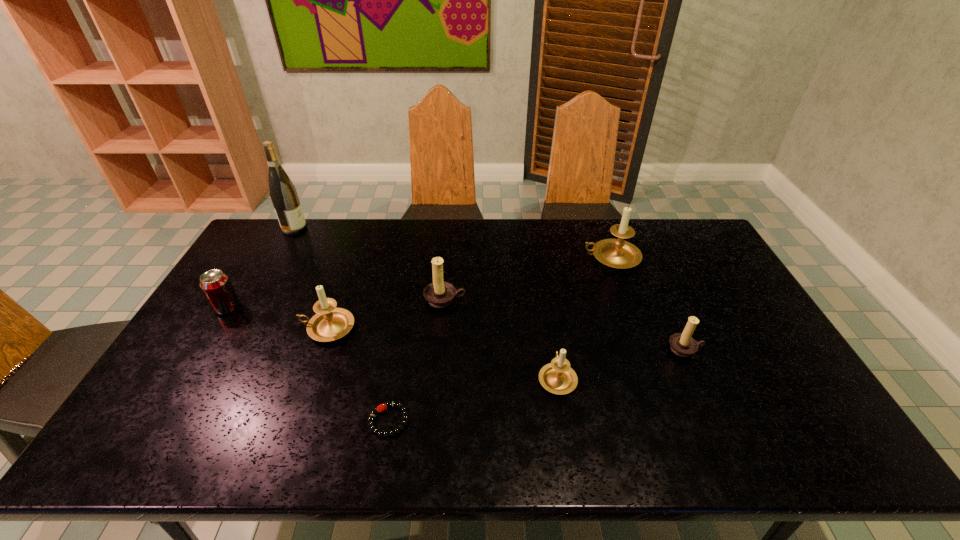
Select which object appears as the sixth closest to the nearest candle holder. Please provide its 2D coordinates. Your answer should be formatted as a tuple, i.e. [(x, y)], where the tuple contains the x and y coordinates of a point satisfying the conditions above.

[(216, 286)]

You are a GUI agent. You are given a task and a screenshot of the screen. Output one action in this format:
    pyautogui.click(x=<x>, y=<y>)
    Task: Click on the object that is the second closest to the smaller brown candle holder
    
    Given the screenshot: What is the action you would take?
    pyautogui.click(x=617, y=253)

Select which candle holder is the closest to the leftmost candle holder. Please provide its 2D coordinates. Your answer should be formatted as a tuple, i.e. [(x, y)], where the tuple contains the x and y coordinates of a point satisfying the conditions above.

[(439, 294)]

Select which candle holder is the fifth closest to the tallest object. Please provide its 2D coordinates. Your answer should be formatted as a tuple, i.e. [(x, y)], where the tuple contains the x and y coordinates of a point satisfying the conditions above.

[(682, 344)]

You are a GUI agent. You are given a task and a screenshot of the screen. Output one action in this format:
    pyautogui.click(x=<x>, y=<y>)
    Task: Click on the closest beige candle holder relative to the farthest candle holder
    The width and height of the screenshot is (960, 540).
    Given the screenshot: What is the action you would take?
    pyautogui.click(x=557, y=377)

Point out which beige candle holder is positioned as the second nearest to the soda can. Please provide its 2D coordinates. Your answer should be formatted as a tuple, i.e. [(x, y)], where the tuple contains the x and y coordinates of a point satisfying the conditions above.

[(557, 377)]

What are the coordinates of `free space that satisfies the following two spatial constraints: 1. on the wick of the bigger brown candle holder; 2. with a handle on the side of the leftmost candle holder` in the screenshot? It's located at (443, 328).

Identify the location of free region that satisfies the following two spatial constraints: 1. with a handle on the side of the second farthest beige candle holder; 2. on the right side of the nearest object. Image resolution: width=960 pixels, height=540 pixels. (296, 421).